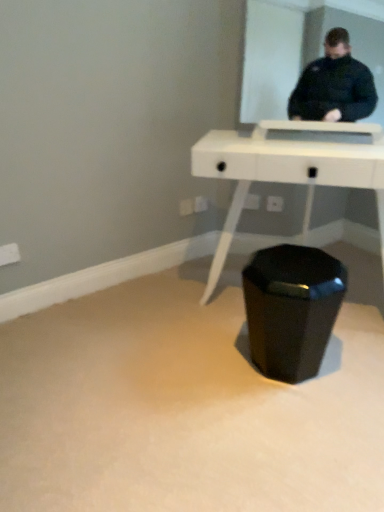
Image resolution: width=384 pixels, height=512 pixels. Find the location of `vacant area that is in front of white glossy table at center`. vacant area that is in front of white glossy table at center is located at coordinates (283, 420).